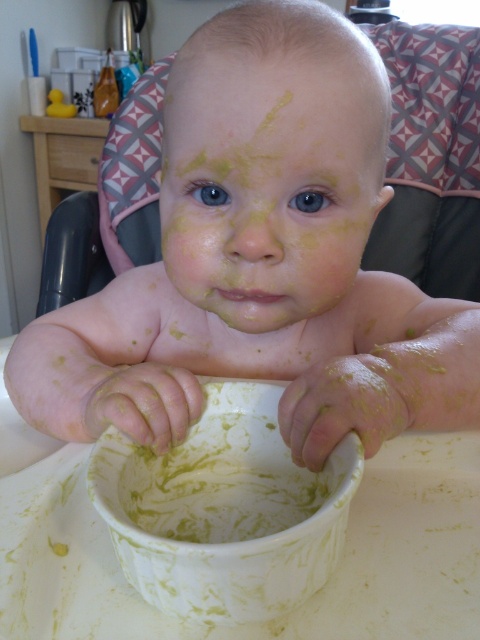
You are a caregiver preparing to feed a baby. You have two bowls in front of you, a white matte bowl at center and a yellow matte bowl at center. Which bowl should you choose if you want to serve a larger portion of food?

The white matte bowl at center is larger in size than the yellow matte bowl at center, so you should choose the white matte bowl at center to serve a larger portion of food.

You are a photographer taking a picture of the baby in the high chair. You notice two points in the image labeled as point (264, 209) and point (117, 481). Which point is closer to the camera?

Point (264, 209) is further to the camera than point (117, 481), so the point closer to the camera is point (117, 481).

You are a caregiver looking at the baby in the high chair. You need to determine if the white matte bowl at center can fit entirely under the yellow matte baby at center. Can it?

The yellow matte baby at center is larger in size than the white matte bowl at center, so the bowl cannot fit entirely under the baby.